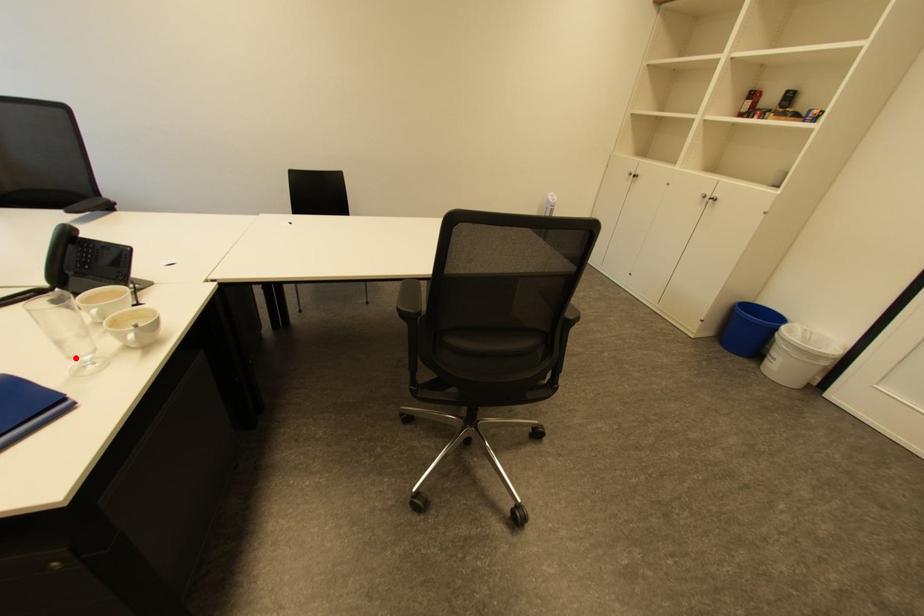
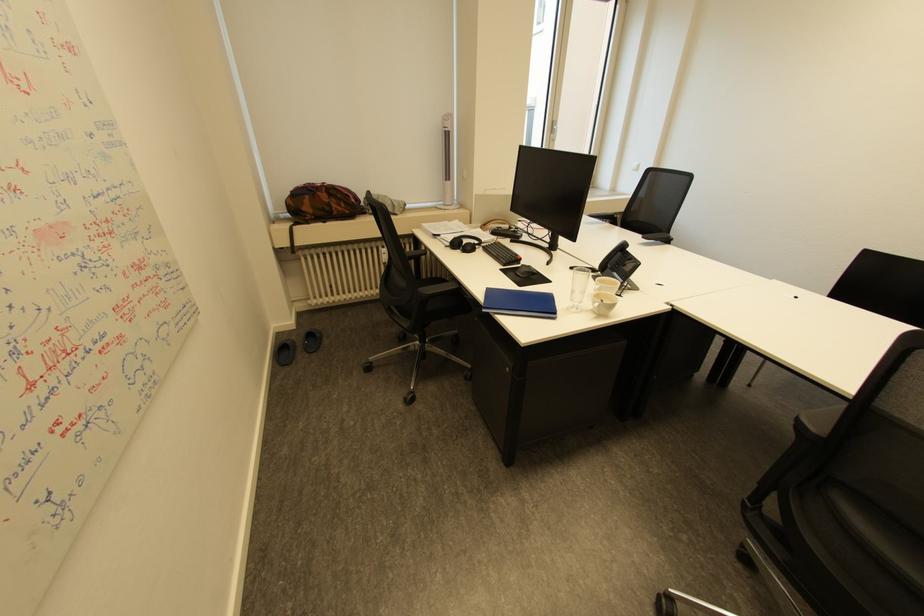
Locate, in the second image, the point that corresponds to the highlighted location in the first image.

(578, 300)